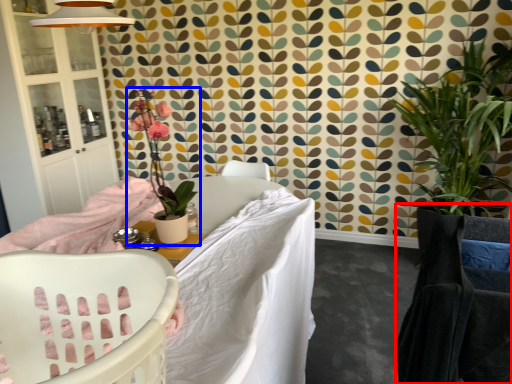
Question: Among these objects, which one is farthest to the camera, rocking chair (highlighted by a red box) or houseplant (highlighted by a blue box)?

Choices:
 (A) rocking chair
 (B) houseplant

Answer: (B)